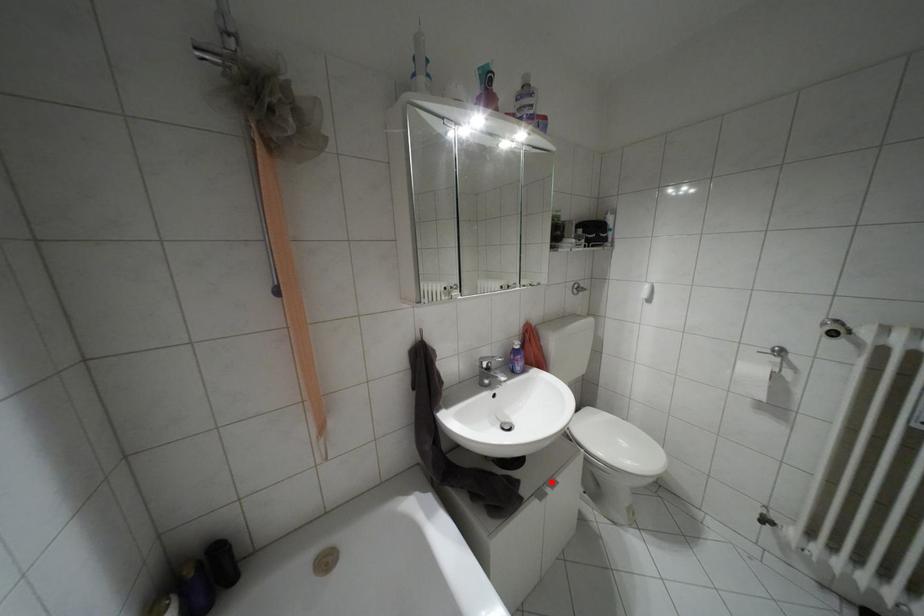
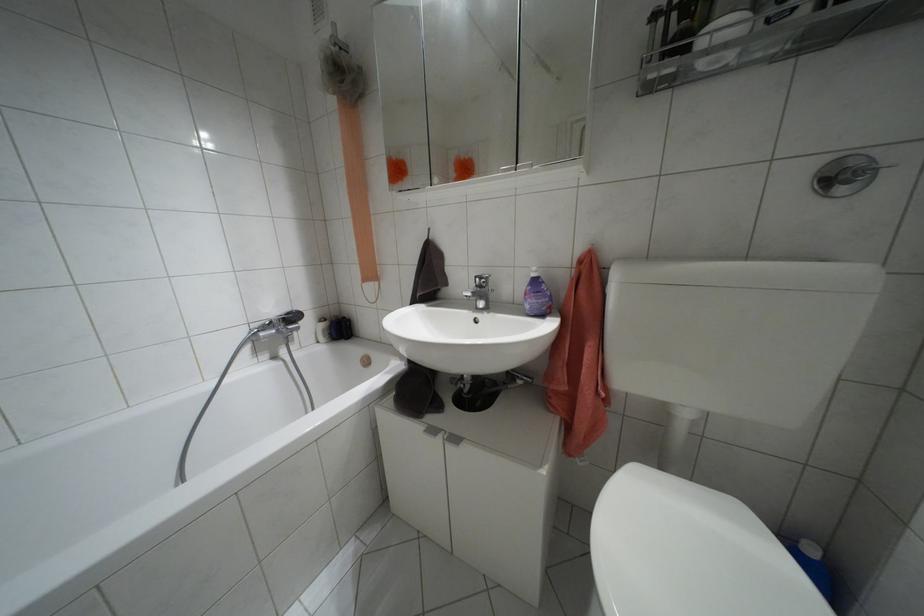
Where in the second image is the point corresponding to the highlighted location from the first image?

(455, 439)